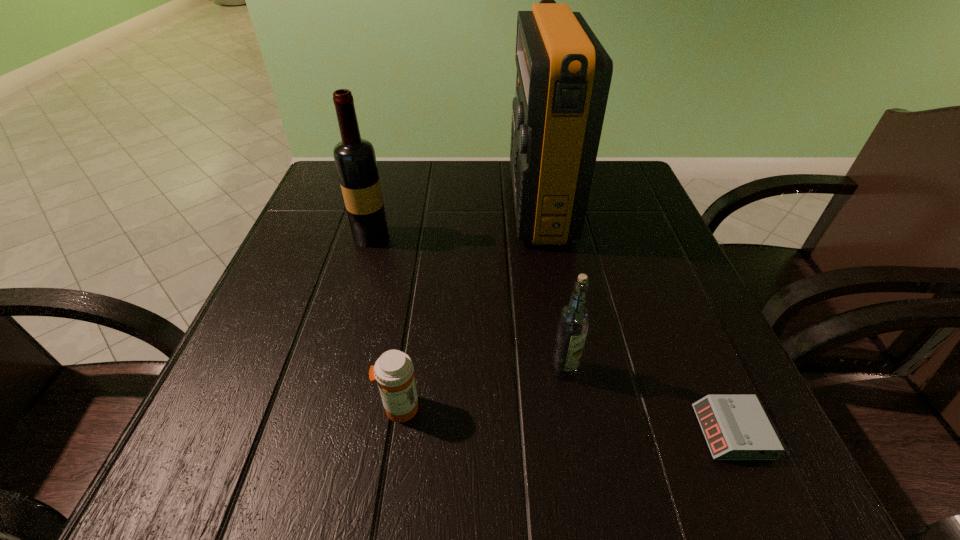
I want to click on free spot between the leftmost object and the third farthest object, so click(468, 303).

The width and height of the screenshot is (960, 540). Identify the location of free space that is in between the medicine and the rightmost object. (565, 420).

Image resolution: width=960 pixels, height=540 pixels. Identify the location of free spot between the tallest object and the wine bottle. (455, 220).

The width and height of the screenshot is (960, 540). I want to click on free space that is in between the second object from left to right and the wine bottle, so click(386, 322).

You are a GUI agent. You are given a task and a screenshot of the screen. Output one action in this format:
    pyautogui.click(x=<x>, y=<y>)
    Task: Click on the free point between the fourth shortest object and the tallest object
    Image resolution: width=960 pixels, height=540 pixels.
    Given the screenshot: What is the action you would take?
    pyautogui.click(x=455, y=220)

I want to click on vacant area between the second shortest object and the third tallest object, so click(482, 388).

Identify which object is located as the nearest to the second object from left to right. Please provide its 2D coordinates. Your answer should be formatted as a tuple, i.e. [(x, y)], where the tuple contains the x and y coordinates of a point satisfying the conditions above.

[(574, 318)]

Select which object is the fourth closest to the second object from left to right. Please provide its 2D coordinates. Your answer should be formatted as a tuple, i.e. [(x, y)], where the tuple contains the x and y coordinates of a point satisfying the conditions above.

[(736, 427)]

Locate an element on the screen. The height and width of the screenshot is (540, 960). free space that satisfies the following two spatial constraints: 1. on the label of the vodka; 2. on the right side of the rightmost object is located at coordinates (574, 432).

You are a GUI agent. You are given a task and a screenshot of the screen. Output one action in this format:
    pyautogui.click(x=<x>, y=<y>)
    Task: Click on the free space that satisfies the following two spatial constraints: 1. on the front-facing side of the alarm clock; 2. on the right side of the radio receiver
    
    Given the screenshot: What is the action you would take?
    pyautogui.click(x=579, y=432)